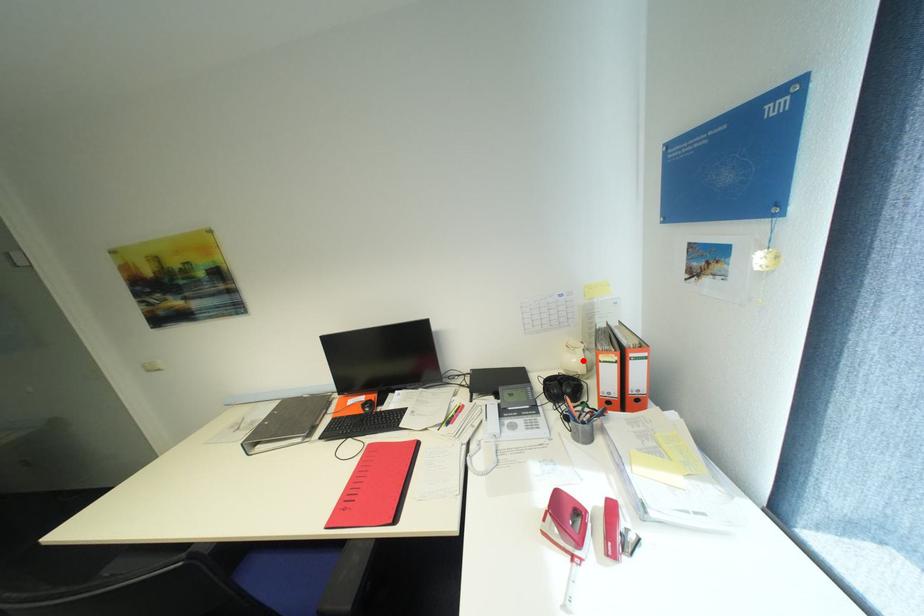
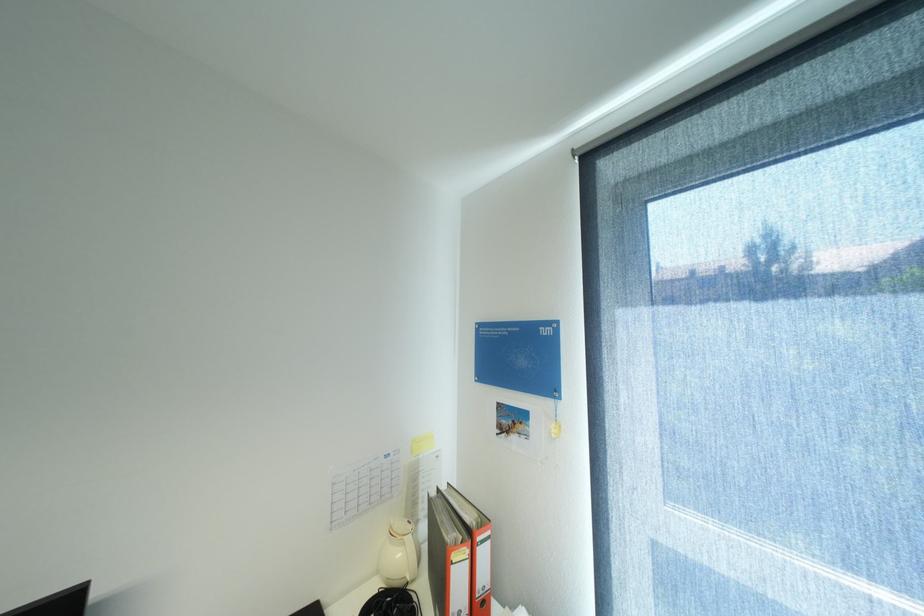
Where in the second image is the point corresponding to the highlighted location from the first image?

(407, 554)